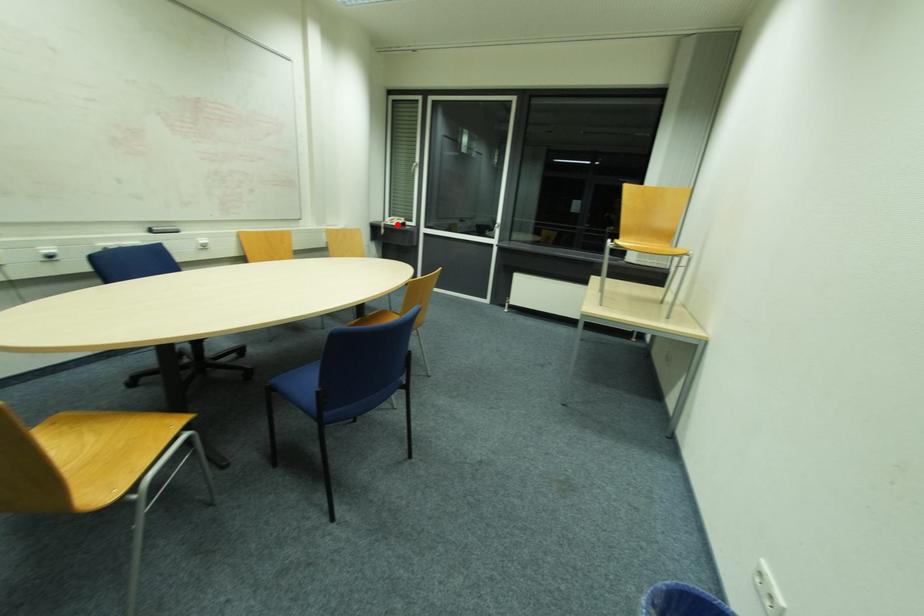
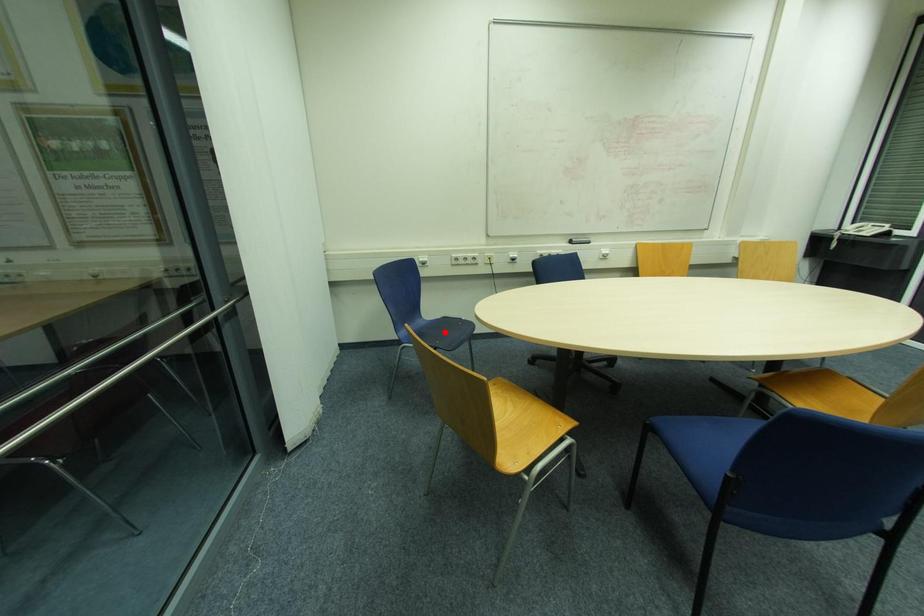
I am providing you with two images of the same scene from different viewpoints. A red point is marked on the first image and another point is marked on the second image. Do the highlighted points in image1 and image2 indicate the same real-world spot?

No